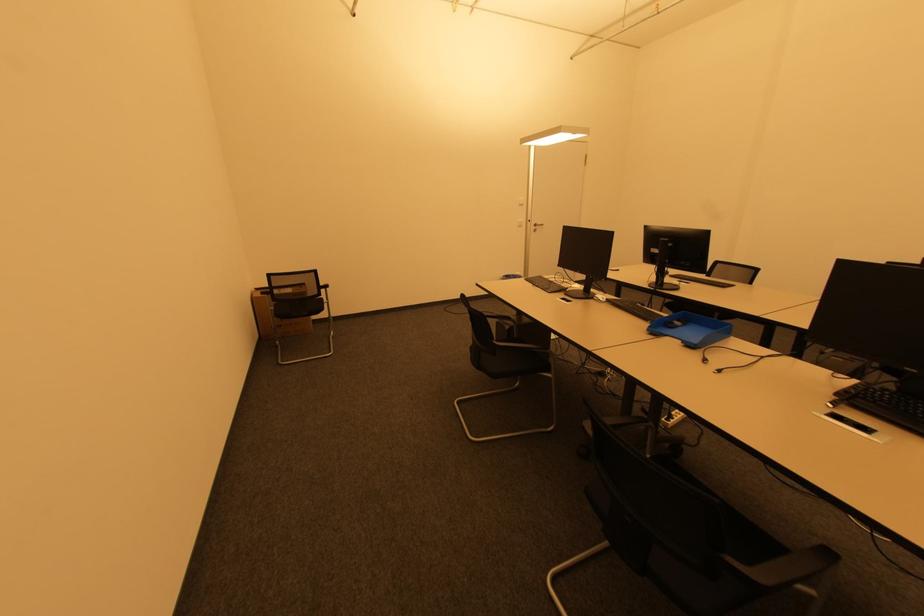
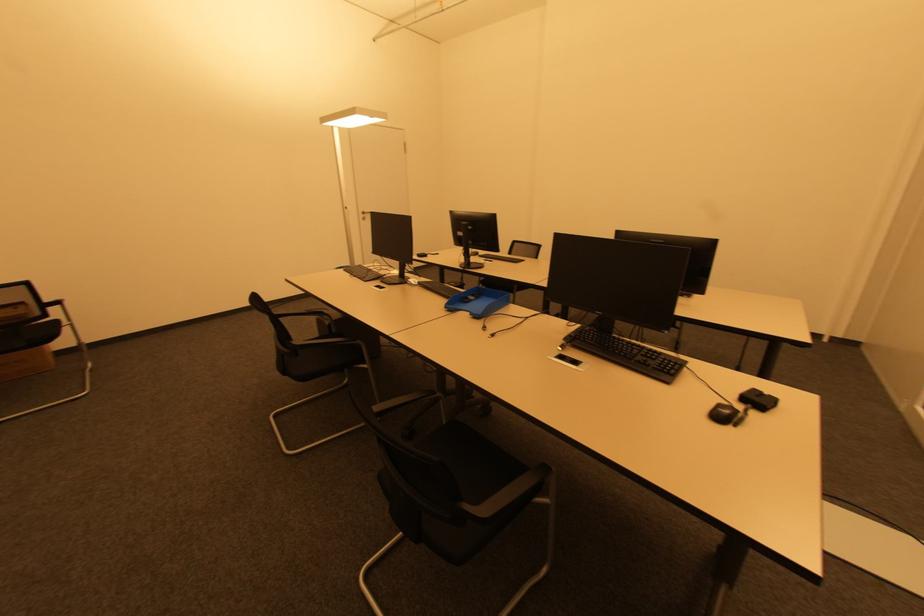
Question: The images are taken continuously from a first-person perspective. In which direction are you moving?

Choices:
 (A) Left
 (B) Right
 (C) Forward
 (D) Backward

Answer: (B)